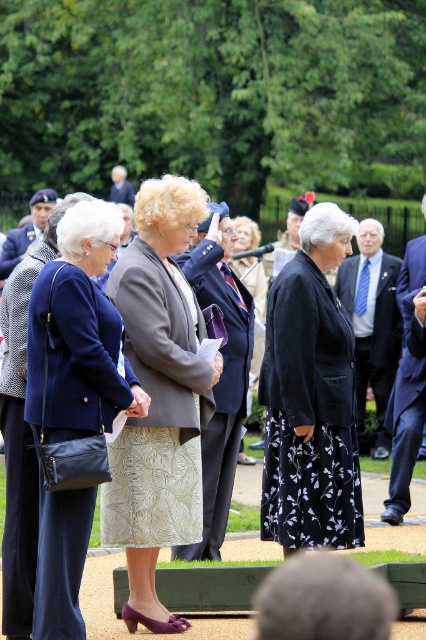
You are a photographer at the event and need to ensure both the navy blue fabric coat at center and the matte black jacket at center are visible in the photo. Given their height difference, which one might appear larger in the photo?

The navy blue fabric coat at center is much taller than the matte black jacket at center, so it will appear larger in the photo.

You are standing at the point labeled point (221, 518) in a formal outdoor gathering. You want to take a photo of the attendees without moving. Can you capture the entire group in one shot if your camera has a standard 50mm lens?

The distance between you and the camera is 13.35 meters. With a standard 50mm lens, this distance should allow the camera to capture the entire group in one shot as the focal length of 50mm is suitable for group photos at such a distance.

You are organizing a charity event and need to ensure that the black floral skirt at center and the matte black jacket at center can be displayed together in a showcase. The showcase has a width of 1.2 meters. Given their sizes, will both items fit side by side?

The black floral skirt at center is larger in size than the matte black jacket at center. However, without specific measurements, it is impossible to determine if they will fit in the 1.2 meter showcase. Additional information about their exact dimensions is required.